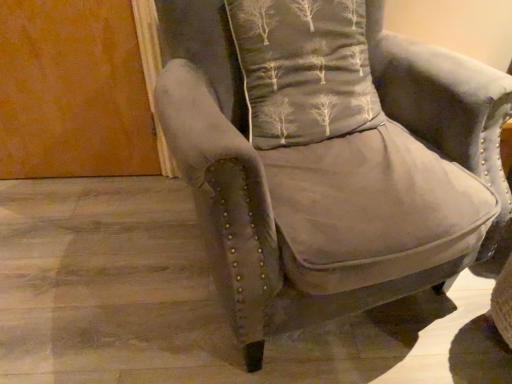
Question: Is point pyautogui.click(x=350, y=46) positioned closer to the camera than point pyautogui.click(x=304, y=178)?

Choices:
 (A) closer
 (B) farther

Answer: (B)

Question: Relative to suede-like gray armchair at center, is dark gray fabric pillow with tree pattern at upper center in front or behind?

Choices:
 (A) front
 (B) behind

Answer: (B)

Question: Which is correct: dark gray fabric pillow with tree pattern at upper center is inside suede-like gray armchair at center, or outside of it?

Choices:
 (A) outside
 (B) inside

Answer: (B)

Question: From a real-world perspective, is suede-like gray armchair at center physically located above or below dark gray fabric pillow with tree pattern at upper center?

Choices:
 (A) above
 (B) below

Answer: (B)

Question: In the image, is suede-like gray armchair at center positioned in front of or behind dark gray fabric pillow with tree pattern at upper center?

Choices:
 (A) behind
 (B) front

Answer: (B)

Question: Is point (474, 226) positioned closer to the camera than point (342, 9)?

Choices:
 (A) closer
 (B) farther

Answer: (A)

Question: From the image's perspective, is suede-like gray armchair at center positioned above or below dark gray fabric pillow with tree pattern at upper center?

Choices:
 (A) above
 (B) below

Answer: (B)